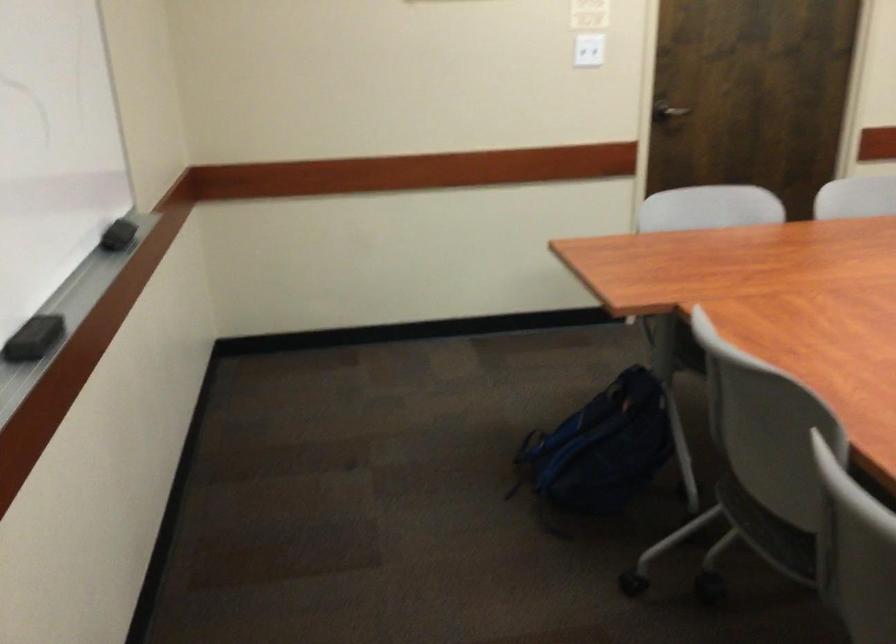
Find where to push the white light switch. Please return your answer as a coordinate pair (x, y).

(588, 51)